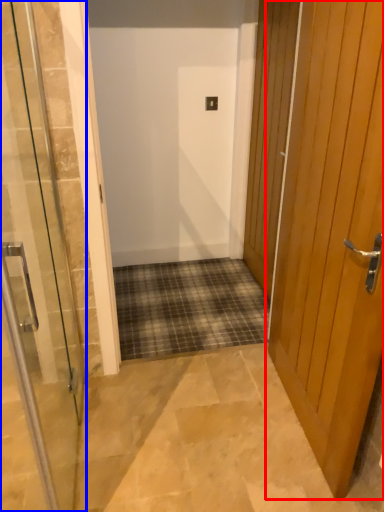
Question: Which object appears farthest to the camera in this image, door (highlighted by a red box) or door (highlighted by a blue box)?

Choices:
 (A) door
 (B) door

Answer: (A)